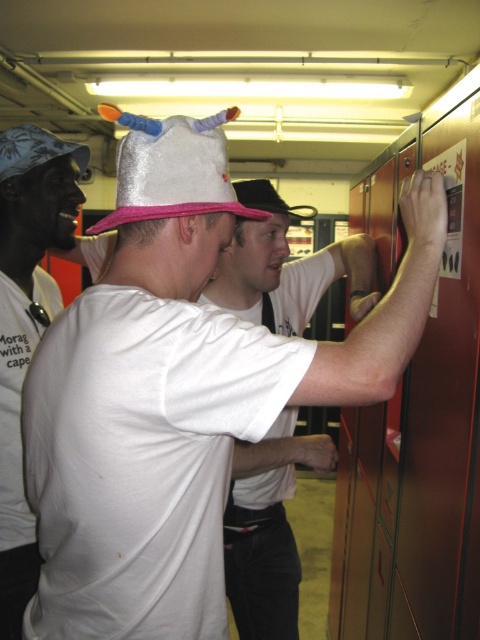
Can you confirm if white matte hat at center is positioned above shiny metallic hat at upper left?

No.

Between point (218, 577) and point (2, 172), which one is positioned in front?

Positioned in front is point (218, 577).

You are a GUI agent. You are given a task and a screenshot of the screen. Output one action in this format:
    pyautogui.click(x=<x>, y=<y>)
    Task: Click on the white matte hat at center
    The width and height of the screenshot is (480, 640).
    Given the screenshot: What is the action you would take?
    pyautogui.click(x=180, y=420)

Is point (253, 321) more distant than point (22, 145)?

Yes.

Where is `white matte shirt at center`? This screenshot has width=480, height=640. white matte shirt at center is located at coordinates (266, 529).

What are the coordinates of `white matte shirt at center` in the screenshot? It's located at (266, 529).

Who is taller, blue fabric cap at upper left or silver glittery hat at center?

blue fabric cap at upper left is taller.

Which is more to the left, blue fabric cap at upper left or silver glittery hat at center?

blue fabric cap at upper left is more to the left.

Locate an element on the screen. blue fabric cap at upper left is located at coordinates (26, 324).